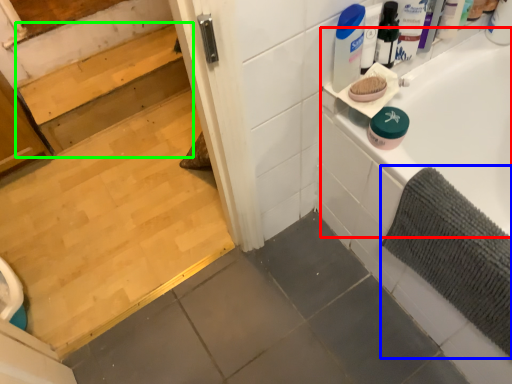
Question: Which is nearer to the bathtub (highlighted by a red box)? bath mat (highlighted by a blue box) or stair (highlighted by a green box).

Choices:
 (A) bath mat
 (B) stair

Answer: (A)